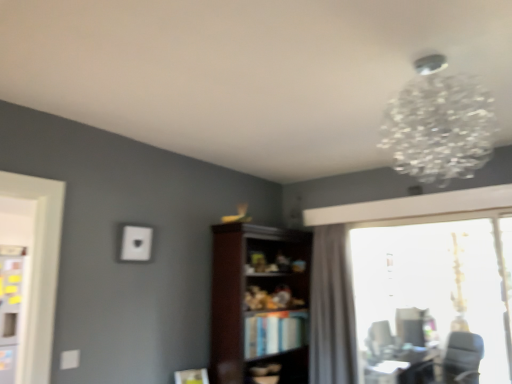
Question: Is black leather swivel chair at lower right, the 1th swivel chair when ordered from right to left, wider than dark wood bookshelf at center?

Choices:
 (A) no
 (B) yes

Answer: (B)

Question: From the image's perspective, does black leather swivel chair at lower right, which ranks as the second swivel chair in left-to-right order, appear higher than dark wood bookshelf at center?

Choices:
 (A) no
 (B) yes

Answer: (A)

Question: Can you confirm if black leather swivel chair at lower right, which ranks as the second swivel chair in left-to-right order, is shorter than dark wood bookshelf at center?

Choices:
 (A) no
 (B) yes

Answer: (B)

Question: Does black leather swivel chair at lower right, the 1th swivel chair when ordered from right to left, have a greater height compared to dark wood bookshelf at center?

Choices:
 (A) no
 (B) yes

Answer: (A)

Question: From a real-world perspective, is black leather swivel chair at lower right, the 1th swivel chair when ordered from right to left, physically above dark wood bookshelf at center?

Choices:
 (A) no
 (B) yes

Answer: (A)

Question: In the image, is matte black swivel chair at lower right, which ranks as the 1th swivel chair in back-to-front order, positioned in front of or behind dark wood bookshelf at center?

Choices:
 (A) behind
 (B) front

Answer: (A)

Question: Is matte black swivel chair at lower right, the second swivel chair in the right-to-left sequence, inside the boundaries of dark wood bookshelf at center, or outside?

Choices:
 (A) inside
 (B) outside

Answer: (B)

Question: From a real-world perspective, is matte black swivel chair at lower right, the first swivel chair from the left, positioned above or below dark wood bookshelf at center?

Choices:
 (A) below
 (B) above

Answer: (A)

Question: Is point (368, 342) positioned closer to the camera than point (219, 380)?

Choices:
 (A) farther
 (B) closer

Answer: (A)

Question: From a real-world perspective, is dark wood bookshelf at center above or below clear crystal chandelier at upper right?

Choices:
 (A) above
 (B) below

Answer: (B)

Question: Considering the positions of dark wood bookshelf at center and clear crystal chandelier at upper right in the image, is dark wood bookshelf at center taller or shorter than clear crystal chandelier at upper right?

Choices:
 (A) short
 (B) tall

Answer: (B)

Question: Do you think dark wood bookshelf at center is within clear crystal chandelier at upper right, or outside of it?

Choices:
 (A) outside
 (B) inside

Answer: (A)

Question: Considering the positions of dark wood bookshelf at center and clear crystal chandelier at upper right in the image, is dark wood bookshelf at center wider or thinner than clear crystal chandelier at upper right?

Choices:
 (A) wide
 (B) thin

Answer: (B)

Question: Is point (314, 233) closer or farther from the camera than point (226, 264)?

Choices:
 (A) farther
 (B) closer

Answer: (A)

Question: Looking at their shapes, would you say gray fabric curtain at right is wider or thinner than dark wood bookshelf at center?

Choices:
 (A) wide
 (B) thin

Answer: (B)